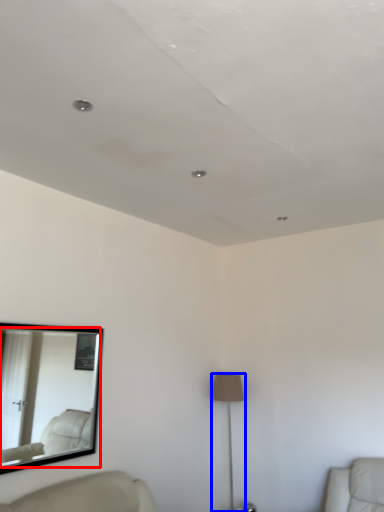
Question: Which of the following is the farthest to the observer, mirror (highlighted by a red box) or lamp (highlighted by a blue box)?

Choices:
 (A) mirror
 (B) lamp

Answer: (B)